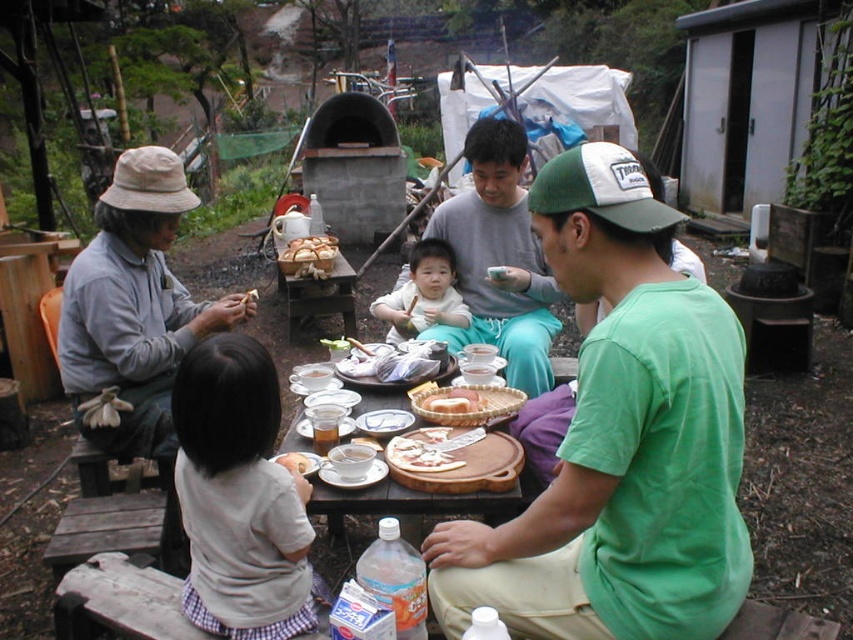
From the picture: Can you confirm if wooden table at center is thinner than white cheese pizza at center?

No.

Locate an element on the screen. wooden table at center is located at coordinates (479, 506).

Consider the image. Between matte green shirt at center and slightly toasted bread at center, which one is positioned higher?

matte green shirt at center

Which is below, matte green shirt at center or slightly toasted bread at center?

Positioned lower is slightly toasted bread at center.

Identify the location of matte green shirt at center. (619, 438).

Can you confirm if gray cotton shirt at left is taller than slightly toasted bread at center?

Yes, gray cotton shirt at left is taller than slightly toasted bread at center.

Consider the image. Is gray cotton shirt at left closer to the viewer compared to slightly toasted bread at center?

No, it is not.

At what (x,y) coordinates should I click in order to perform the action: click on gray cotton shirt at left. Please return your answer as a coordinate pair (x, y). This screenshot has height=640, width=853. Looking at the image, I should click on pyautogui.click(x=135, y=305).